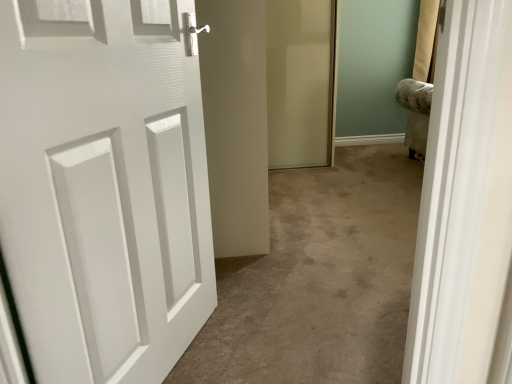
Question: Are white matte door at left and translucent glass screen door at center beside each other?

Choices:
 (A) no
 (B) yes

Answer: (A)

Question: From a real-world perspective, is white matte door at left below translucent glass screen door at center?

Choices:
 (A) no
 (B) yes

Answer: (B)

Question: Is white matte door at left positioned before translucent glass screen door at center?

Choices:
 (A) yes
 (B) no

Answer: (A)

Question: Is white matte door at left further to camera compared to translucent glass screen door at center?

Choices:
 (A) no
 (B) yes

Answer: (A)

Question: From a real-world perspective, is white matte door at left over translucent glass screen door at center?

Choices:
 (A) yes
 (B) no

Answer: (B)

Question: Does white matte door at left appear on the right side of translucent glass screen door at center?

Choices:
 (A) yes
 (B) no

Answer: (B)

Question: Is translucent glass screen door at center far away from white matte door at left?

Choices:
 (A) no
 (B) yes

Answer: (B)

Question: Does translucent glass screen door at center have a lesser height compared to white matte door at left?

Choices:
 (A) no
 (B) yes

Answer: (A)

Question: Can you confirm if translucent glass screen door at center is thinner than white matte door at left?

Choices:
 (A) yes
 (B) no

Answer: (B)

Question: From a real-world perspective, is translucent glass screen door at center beneath white matte door at left?

Choices:
 (A) no
 (B) yes

Answer: (A)

Question: Can you confirm if translucent glass screen door at center is bigger than white matte door at left?

Choices:
 (A) no
 (B) yes

Answer: (B)

Question: Does translucent glass screen door at center appear on the left side of white matte door at left?

Choices:
 (A) no
 (B) yes

Answer: (A)

Question: Do you think white matte door at left is within translucent glass screen door at center, or outside of it?

Choices:
 (A) inside
 (B) outside

Answer: (B)